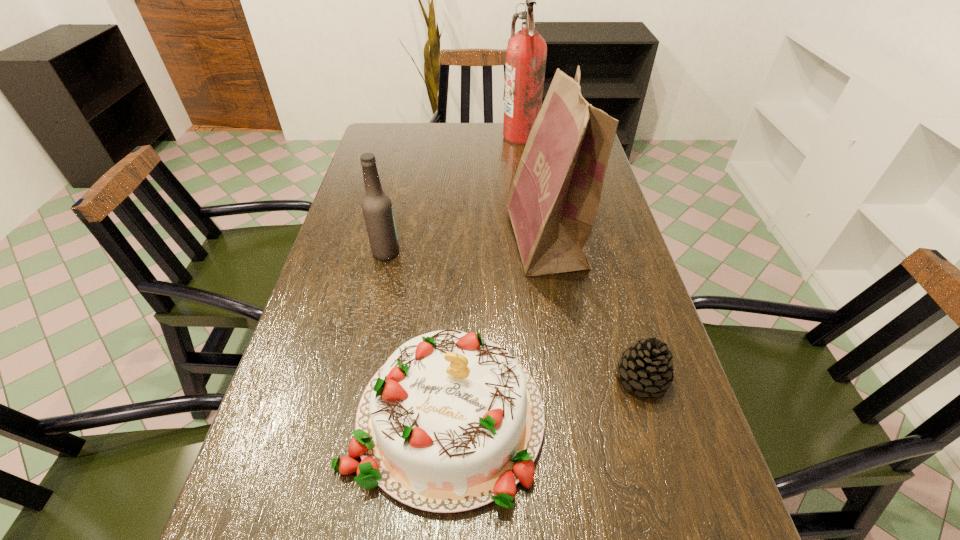
This screenshot has width=960, height=540. Identify the location of pinecone situated at the right edge. (646, 366).

Locate an element on the screen. free space at the left edge of the desktop is located at coordinates (316, 410).

I want to click on free space at the right edge of the desktop, so click(x=632, y=288).

This screenshot has height=540, width=960. I want to click on free space between the pinecone and the second shortest object, so [544, 397].

In order to click on free space between the third tallest object and the shortest object in this screenshot , I will do `click(514, 315)`.

This screenshot has width=960, height=540. What are the coordinates of `unoccupied position between the farthest object and the second shortest object` in the screenshot? It's located at (483, 276).

Image resolution: width=960 pixels, height=540 pixels. In order to click on vacant space that is in between the beer bottle and the shortest object in this screenshot , I will do `click(514, 315)`.

Find the location of a particular element. vacant area that lies between the fourth tallest object and the shortest object is located at coordinates (544, 397).

What are the coordinates of `vacant area between the shortest object and the grocery bag` in the screenshot? It's located at (594, 308).

Select which object appears as the closest to the beer bottle. Please provide its 2D coordinates. Your answer should be formatted as a tuple, i.e. [(x, y)], where the tuple contains the x and y coordinates of a point satisfying the conditions above.

[(451, 422)]